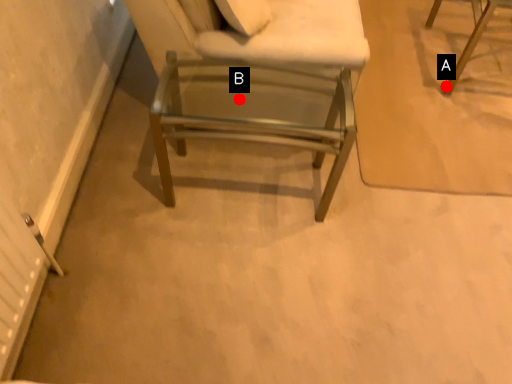
Question: Two points are circled on the image, labeled by A and B beside each circle. Among these points, which one is farthest from the camera?

Choices:
 (A) A is further
 (B) B is further

Answer: (A)